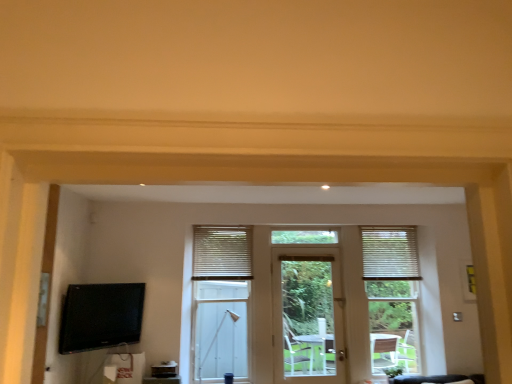
Question: From a real-world perspective, is black glossy tv at lower left physically below white textured blinds at right, the second window blind viewed from the left?

Choices:
 (A) no
 (B) yes

Answer: (B)

Question: Is there a large distance between black glossy tv at lower left and white textured blinds at right, marked as the 1th window blind in a right-to-left arrangement?

Choices:
 (A) yes
 (B) no

Answer: (A)

Question: Considering the relative positions of black glossy tv at lower left and white textured blinds at right, marked as the 1th window blind in a right-to-left arrangement, in the image provided, is black glossy tv at lower left to the right of white textured blinds at right, marked as the 1th window blind in a right-to-left arrangement, from the viewer's perspective?

Choices:
 (A) yes
 (B) no

Answer: (B)

Question: From the image's perspective, is black glossy tv at lower left under white textured blinds at right, marked as the 1th window blind in a right-to-left arrangement?

Choices:
 (A) no
 (B) yes

Answer: (B)

Question: From the image's perspective, is black glossy tv at lower left located above white textured blinds at right, marked as the 1th window blind in a right-to-left arrangement?

Choices:
 (A) yes
 (B) no

Answer: (B)

Question: Considering the positions of white wooden door at center and black glossy tv at lower left in the image, is white wooden door at center taller or shorter than black glossy tv at lower left?

Choices:
 (A) short
 (B) tall

Answer: (B)

Question: Is point (334, 312) positioned closer to the camera than point (66, 334)?

Choices:
 (A) farther
 (B) closer

Answer: (A)

Question: In the image, is white wooden door at center on the left side or the right side of black glossy tv at lower left?

Choices:
 (A) left
 (B) right

Answer: (B)

Question: Is white wooden door at center spatially inside black glossy tv at lower left, or outside of it?

Choices:
 (A) outside
 (B) inside

Answer: (A)

Question: From the image's perspective, is black glossy tv at lower left above or below white textured blinds at center?

Choices:
 (A) above
 (B) below

Answer: (A)

Question: From a real-world perspective, is black glossy tv at lower left physically located above or below white textured blinds at center?

Choices:
 (A) above
 (B) below

Answer: (B)

Question: Is black glossy tv at lower left spatially inside white textured blinds at center, or outside of it?

Choices:
 (A) inside
 (B) outside

Answer: (B)

Question: Looking at their shapes, would you say black glossy tv at lower left is wider or thinner than white textured blinds at center?

Choices:
 (A) thin
 (B) wide

Answer: (A)

Question: From the image's perspective, relative to white textured blinds at center, the 1th window blind in the left-to-right sequence, is white textured blinds at center above or below?

Choices:
 (A) below
 (B) above

Answer: (A)

Question: Is point (228, 314) positioned closer to the camera than point (205, 236)?

Choices:
 (A) closer
 (B) farther

Answer: (A)